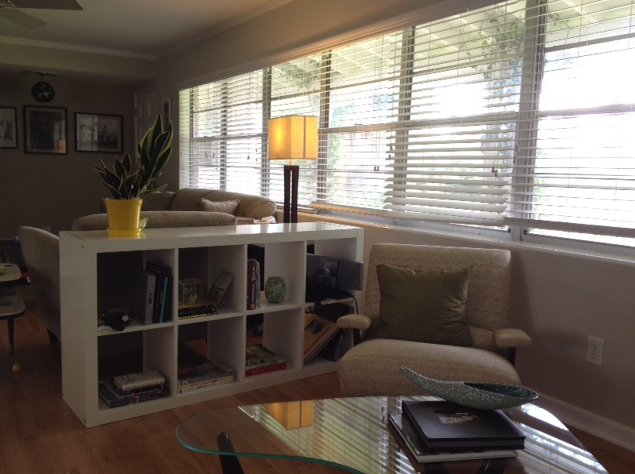
The height and width of the screenshot is (474, 635). Identify the location of picture frames. (4, 127), (39, 127), (93, 130).